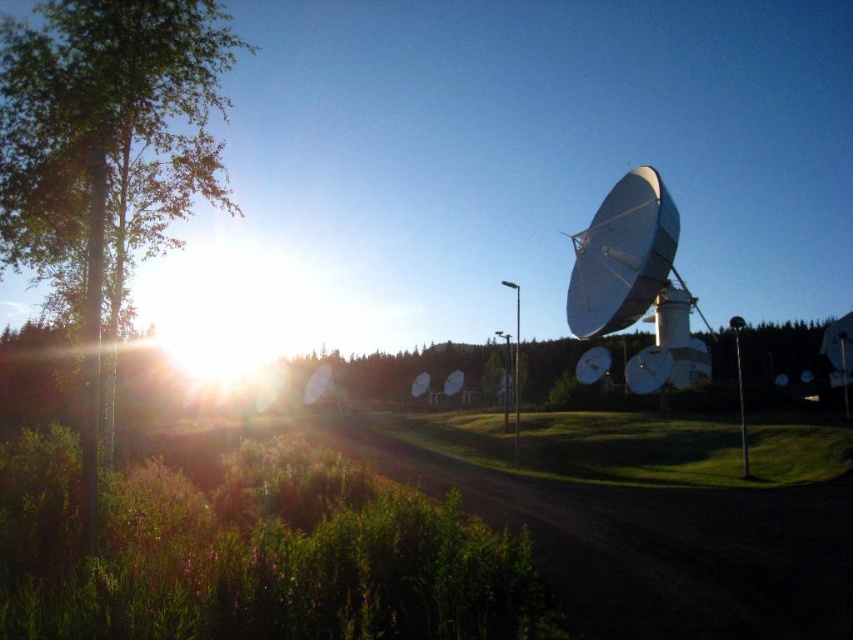
Question: Which of these objects is positioned closest to the white glossy satellite dish at right?

Choices:
 (A) green grass at center
 (B) green leafy tree at left

Answer: (A)

Question: Does green grass at center have a larger size compared to white glossy satellite dish at right?

Choices:
 (A) yes
 (B) no

Answer: (B)

Question: Is green leafy tree at left below white glossy satellite dish at right?

Choices:
 (A) yes
 (B) no

Answer: (B)

Question: Is green grass at center thinner than white glossy satellite dish at right?

Choices:
 (A) yes
 (B) no

Answer: (B)

Question: Among these objects, which one is nearest to the camera?

Choices:
 (A) green leafy tree at left
 (B) white glossy satellite dish at right
 (C) green grass at center

Answer: (A)

Question: Which object is closer to the camera taking this photo?

Choices:
 (A) green grass at center
 (B) green leafy tree at left
 (C) white glossy satellite dish at right

Answer: (B)